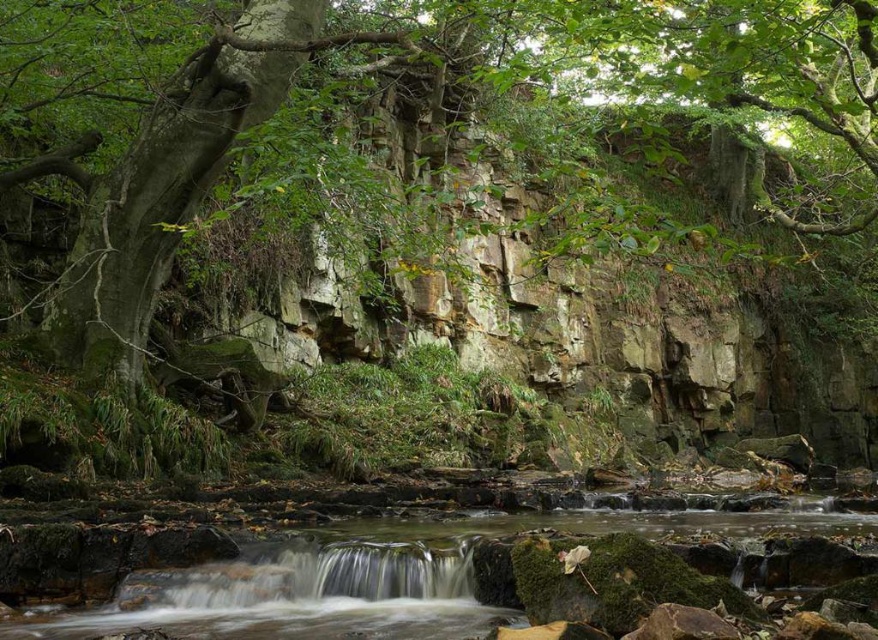
Who is positioned more to the left, green rough bark tree at center or green mossy rocks at center?

From the viewer's perspective, green mossy rocks at center appears more on the left side.

Measure the distance from green rough bark tree at center to green mossy rocks at center.

green rough bark tree at center is 44.26 feet away from green mossy rocks at center.

Is point (360, 22) closer to camera compared to point (360, 612)?

That is False.

The image size is (878, 640). What are the coordinates of `green rough bark tree at center` in the screenshot? It's located at (458, 195).